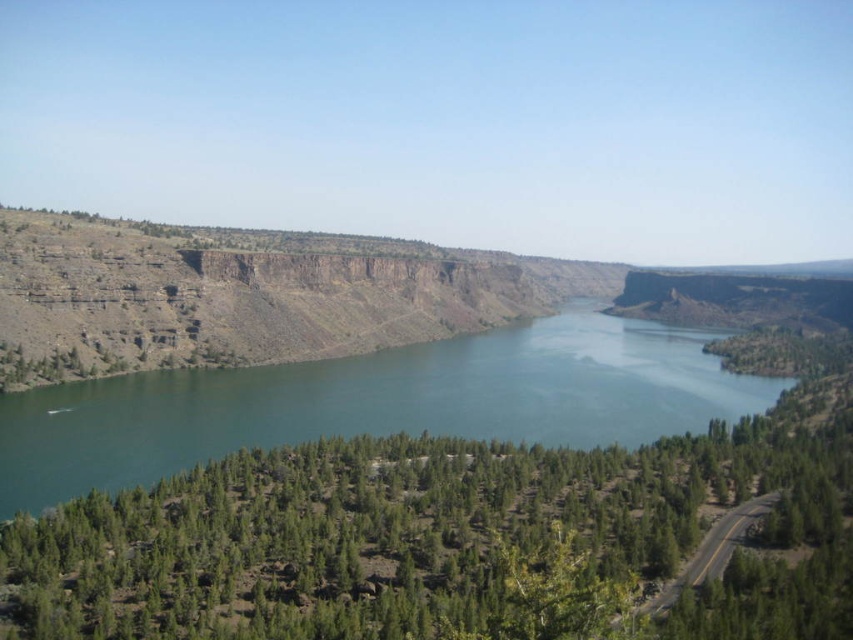
You are standing at the point marked as point (456, 540) in the image. What object is exactly at that location?

The green leafy trees at center are exactly located at point (456, 540).

In the scene shown: You are a hiker standing at the edge of the water and want to reach the green leafy trees at center. According to the coordinates provided, which direction should you head towards?

The green leafy trees at center are located at coordinates point (x=456, y=540), so you should head towards the center of the image to reach them.